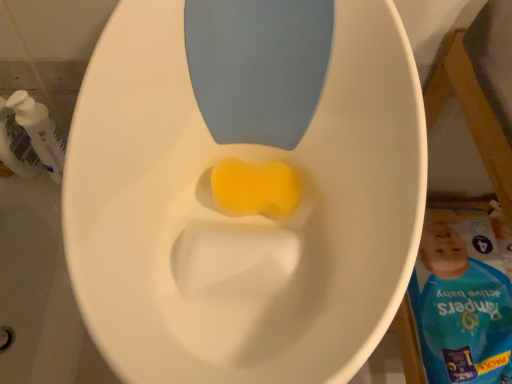
Question: From their relative heights in the image, would you say white plastic pump bottle at left is taller or shorter than yellow sponge at center?

Choices:
 (A) tall
 (B) short

Answer: (A)

Question: Visually, is white plastic pump bottle at left positioned to the left or to the right of yellow sponge at center?

Choices:
 (A) right
 (B) left

Answer: (B)

Question: From a real-world perspective, is white plastic pump bottle at left above or below yellow sponge at center?

Choices:
 (A) below
 (B) above

Answer: (A)

Question: Considering the positions of point (221, 178) and point (41, 148), is point (221, 178) closer or farther from the camera than point (41, 148)?

Choices:
 (A) farther
 (B) closer

Answer: (B)

Question: Relative to white plastic pump bottle at left, is yellow sponge at center in front or behind?

Choices:
 (A) behind
 (B) front

Answer: (B)

Question: From a real-world perspective, relative to white plastic pump bottle at left, is yellow sponge at center vertically above or below?

Choices:
 (A) below
 (B) above

Answer: (B)

Question: Considering the relative positions of yellow sponge at center and white plastic pump bottle at left in the image provided, is yellow sponge at center to the left or to the right of white plastic pump bottle at left?

Choices:
 (A) right
 (B) left

Answer: (A)